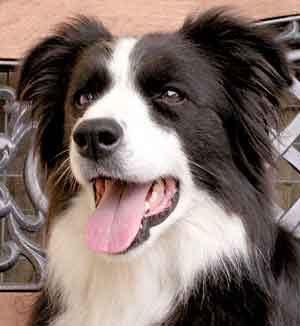
At what (x,y) coordinates should I click in order to perform the action: click on wall. Please return your answer as a coordinate pair (x, y). The height and width of the screenshot is (326, 300). Looking at the image, I should click on (139, 25).